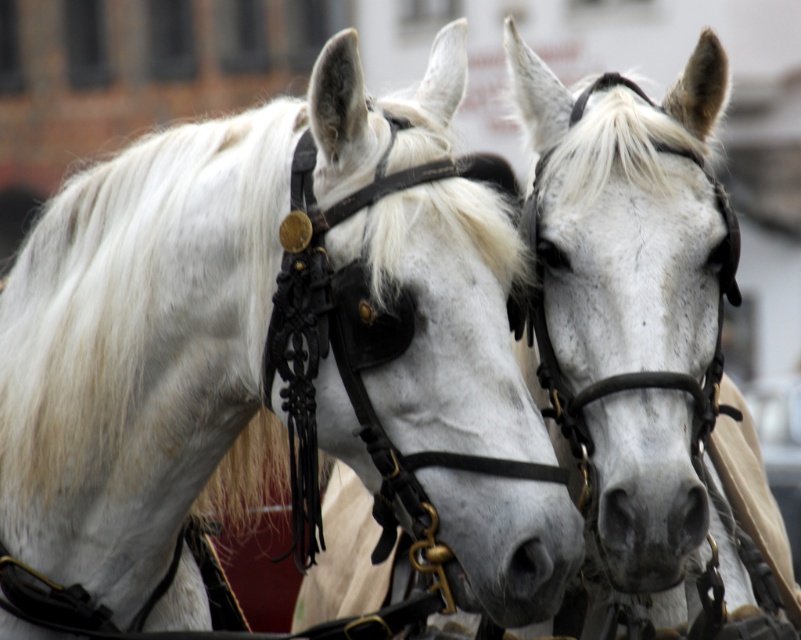
You are a photographer trying to capture a closeup of the white matte horse at center and the white leather bridle at center. Since you want to focus on the horse, which object should you adjust your camera settings to prioritize in terms of size in the frame?

The white matte horse at center is smaller than the white leather bridle at center, so to prioritize the horse in terms of size in the frame, you should adjust your camera settings to focus on the white matte horse at center.

You are a photographer taking a picture of the white matte horse at center and the gray matte nose at center. Which object should you focus on to capture the one that is higher in the frame?

The white matte horse at center is above the gray matte nose at center, so you should focus on the white matte horse at center to capture the higher one.